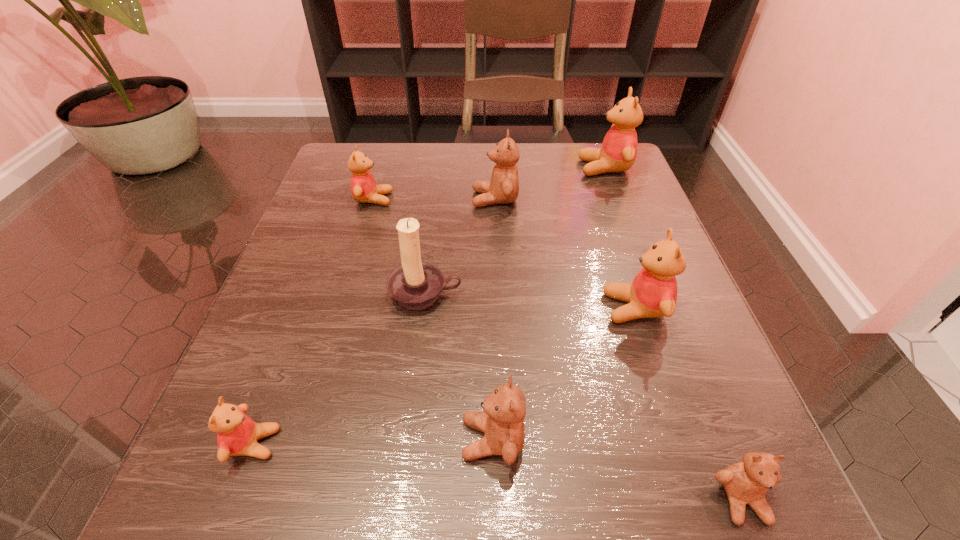
I want to click on the smallest brown teddy bear, so click(x=747, y=482).

What are the coordinates of `vacant region located on the front-facing side of the farthest red teddy bear` in the screenshot? It's located at (414, 168).

The image size is (960, 540). Find the location of `free spot located 0.370m on the front-facing side of the farthest red teddy bear`. free spot located 0.370m on the front-facing side of the farthest red teddy bear is located at coordinates (422, 168).

Locate an element on the screen. The height and width of the screenshot is (540, 960). free spot located 0.200m on the front-facing side of the farthest red teddy bear is located at coordinates (494, 168).

This screenshot has width=960, height=540. I want to click on free point located on the wick of the candle holder, so click(418, 361).

Locate an element on the screen. This screenshot has width=960, height=540. free region located on the face of the biggest brown teddy bear is located at coordinates (426, 199).

The width and height of the screenshot is (960, 540). I want to click on vacant space located on the face of the biggest brown teddy bear, so click(x=384, y=199).

At what (x,y) coordinates should I click in order to perform the action: click on free space located on the face of the biggest brown teddy bear. Please return your answer as a coordinate pair (x, y). Looking at the image, I should click on (389, 199).

Locate an element on the screen. free spot located 0.110m on the front-facing side of the third smallest red teddy bear is located at coordinates (540, 308).

The height and width of the screenshot is (540, 960). In order to click on vacant point located on the front-facing side of the third smallest red teddy bear in this screenshot , I will do `click(400, 308)`.